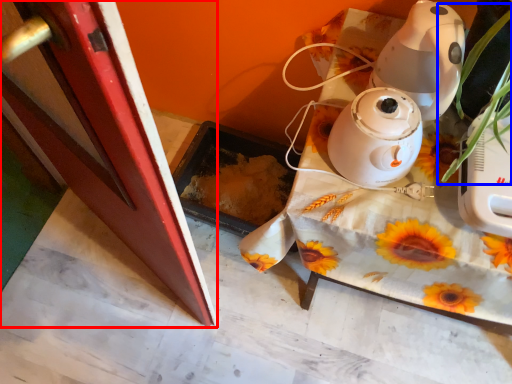
Question: Which point is closer to the camera, screen door (highlighted by a red box) or plant (highlighted by a blue box)?

Choices:
 (A) screen door
 (B) plant

Answer: (B)